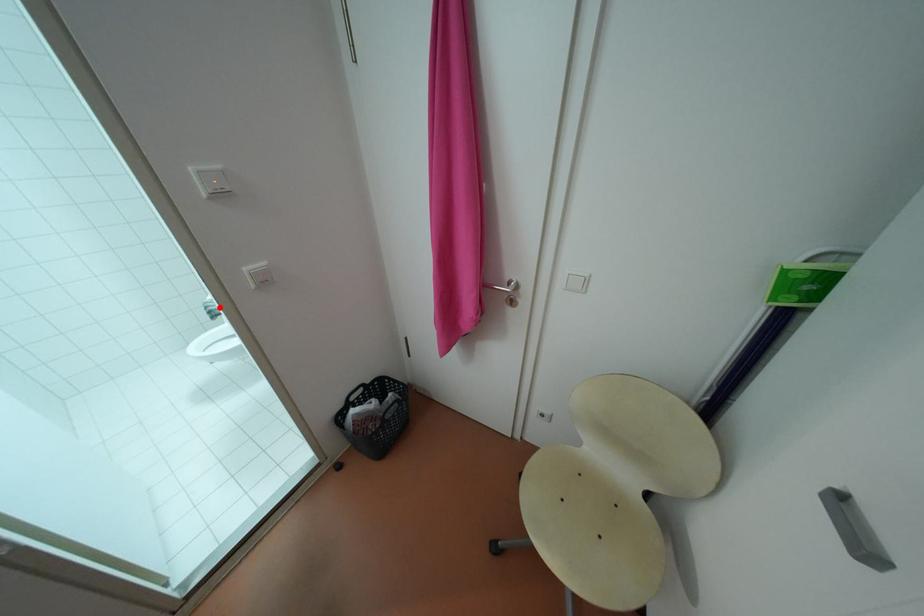
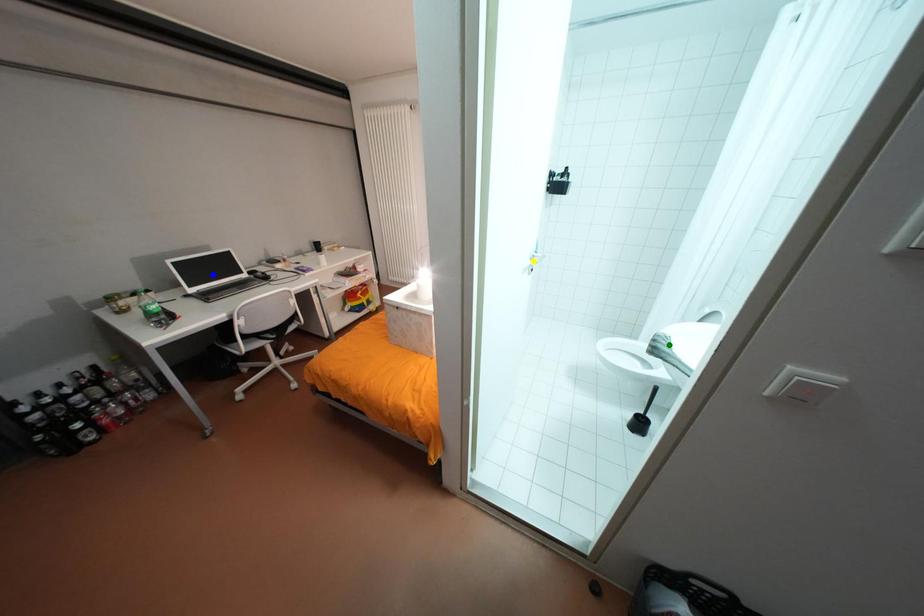
Question: I am providing you with two images of the same scene from different viewpoints. A red point is marked on the first image. You are given multiple points on the second image. Which point in image 2 is actually the same real-world point as the red point in image 1?

Choices:
 (A) blue point
 (B) yellow point
 (C) green point

Answer: (C)